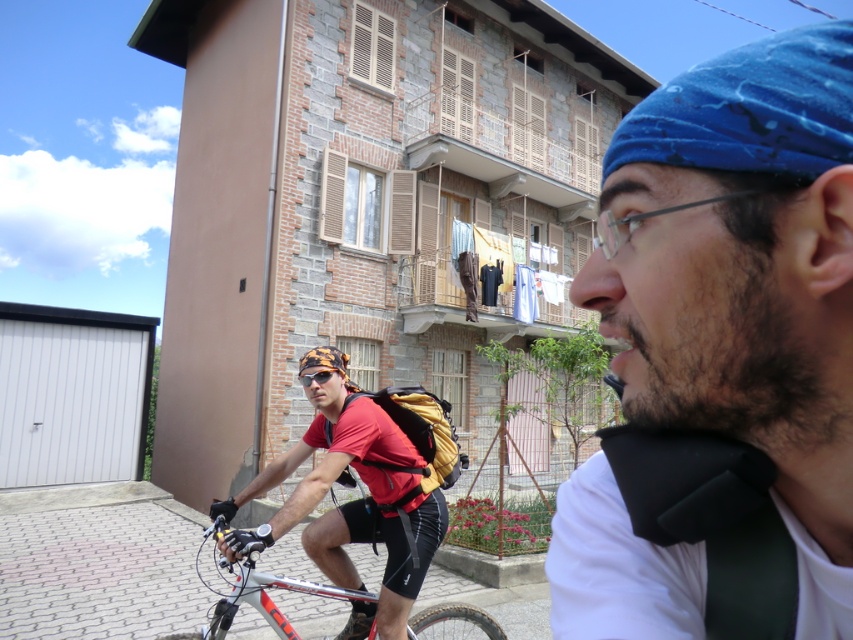
You are a fashion designer observing the outdoor scene. You notice the blue fabric headband at upper right and the camouflage fabric helmet at center. Which accessory is positioned higher in the image?

The blue fabric headband at upper right is located above the camouflage fabric helmet at center, so it is positioned higher in the image.

You are standing in the residential area shown in the image and want to walk from point (254, 554) to point (302, 362). Which direction should you move to get closer to your destination?

To move from point (254, 554) to point (302, 362), you should move towards the left since point (302, 362) is located to the left of point (254, 554).